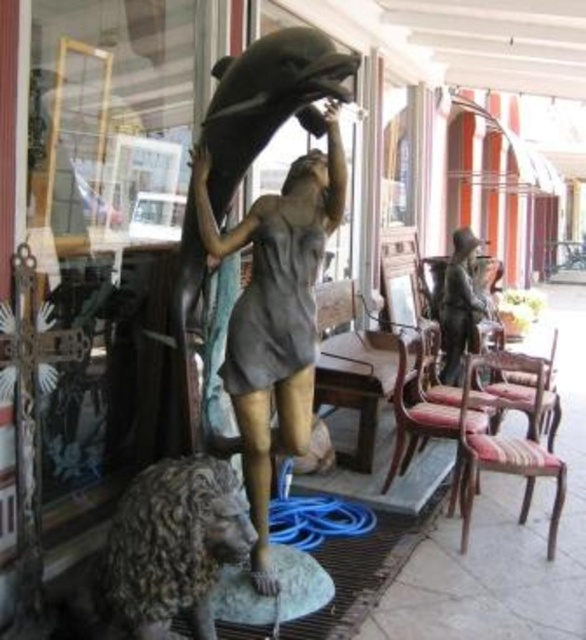
Question: Based on their relative distances, which object is nearer to the bronze statue at center?

Choices:
 (A) bronze statue at right
 (B) wooden chair with upholstered seat at right

Answer: (B)

Question: Which point is farther from the camera taking this photo?

Choices:
 (A) click(x=203, y=508)
 (B) click(x=488, y=458)
 (C) click(x=397, y=394)
 (D) click(x=206, y=227)

Answer: (C)

Question: Does bronze lion at lower left appear under bronze statue at right?

Choices:
 (A) yes
 (B) no

Answer: (A)

Question: Does bronze statue at center lie behind bronze lion at lower left?

Choices:
 (A) no
 (B) yes

Answer: (B)

Question: Which object is farther from the camera taking this photo?

Choices:
 (A) bronze lion at lower left
 (B) bronze statue at center

Answer: (B)

Question: Is bronze lion at lower left wider than striped fabric chair at right?

Choices:
 (A) no
 (B) yes

Answer: (A)